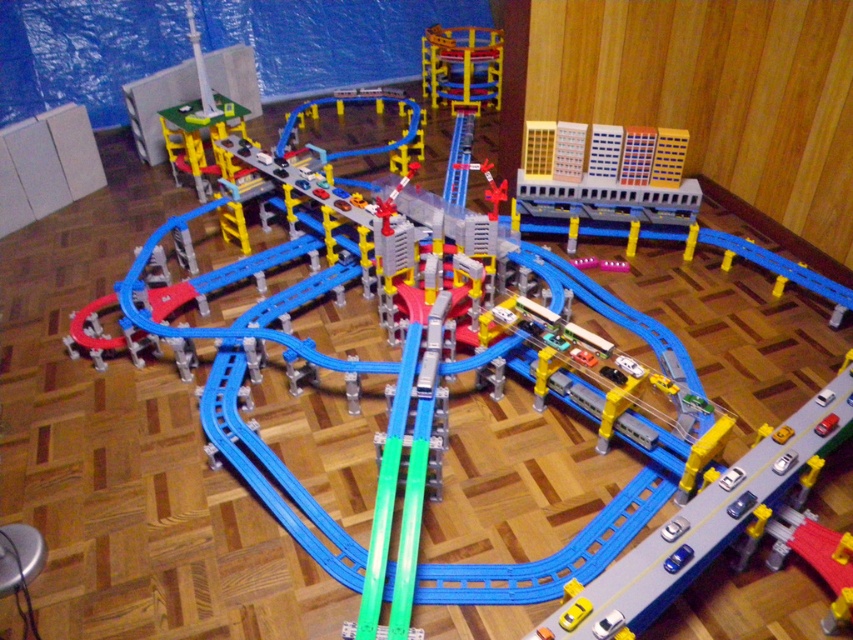
You are a child playing with the toy city. You want to place a new toy airplane on top of the highest point between the yellow plastic building at upper right and the metallic blue train car at upper center. Which object should you choose to place it on?

The metallic blue train car at upper center is higher than the yellow plastic building at upper right, so you should place the toy airplane on top of the metallic blue train car at upper center.

You are a child playing with the toy trains. You want to move the metallic silver train at center to the left side of the metallic blue train car at upper center. Is this possible based on their current positions?

The metallic silver train at center is currently positioned on the right side of the metallic blue train car at upper center. To move it to the left side of the metallic blue train car at upper center, you would need to shift it to the left relative to the blue train car.

You are a parent setting up a toy train set for your child. You have two trains available, the metallic silver train at center and the metallic blue train car at upper center. Your child wants to know which train is shorter. What do you tell them?

The metallic silver train at center is shorter than the metallic blue train car at upper center.